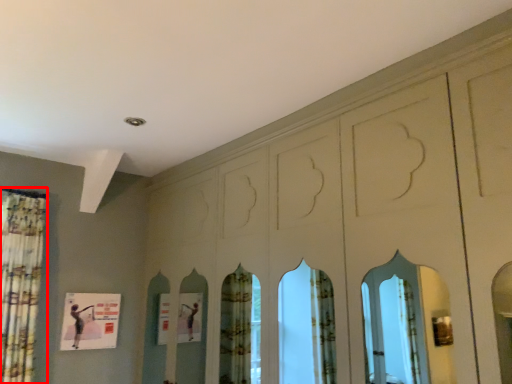
Question: Considering the relative positions of shower curtain (annotated by the red box) and poster in the image provided, where is shower curtain (annotated by the red box) located with respect to the staircase?

Choices:
 (A) left
 (B) right

Answer: (A)